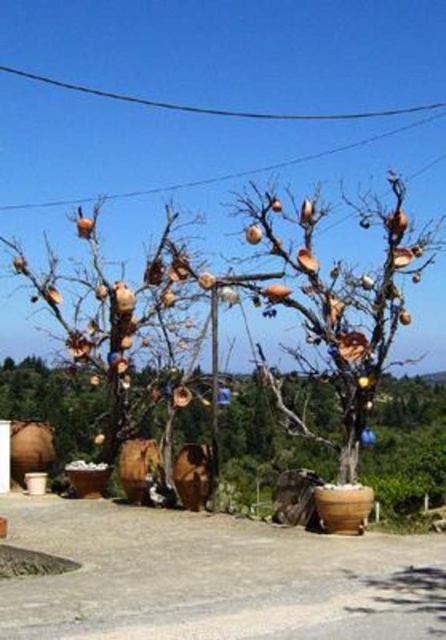
Who is more distant from viewer, (x=166, y=346) or (x=272, y=296)?

Point (x=166, y=346)

Can you confirm if matte brown tree at left is taller than matte ceramic tree at center?

Indeed, matte brown tree at left has a greater height compared to matte ceramic tree at center.

Is point (140, 360) positioned before point (368, 212)?

No, it is not.

Image resolution: width=446 pixels, height=640 pixels. Identify the location of matte brown tree at left. (132, 333).

Is matte ceramic tree at center wider than black wire at upper center?

Incorrect, matte ceramic tree at center's width does not surpass black wire at upper center's.

Between matte ceramic tree at center and black wire at upper center, which one is positioned higher?

black wire at upper center

Describe the element at coordinates (338, 307) in the screenshot. I see `matte ceramic tree at center` at that location.

At what (x,y) coordinates should I click in order to perform the action: click on matte ceramic tree at center. Please return your answer as a coordinate pair (x, y). Looking at the image, I should click on (338, 307).

Who is positioned more to the left, matte brown tree at left or black wire at upper center?

matte brown tree at left

Who is shorter, matte brown tree at left or black wire at upper center?

black wire at upper center

Find the location of a particular element. The height and width of the screenshot is (640, 446). matte brown tree at left is located at coordinates (132, 333).

Identify the location of matte brown tree at left. This screenshot has width=446, height=640. (132, 333).